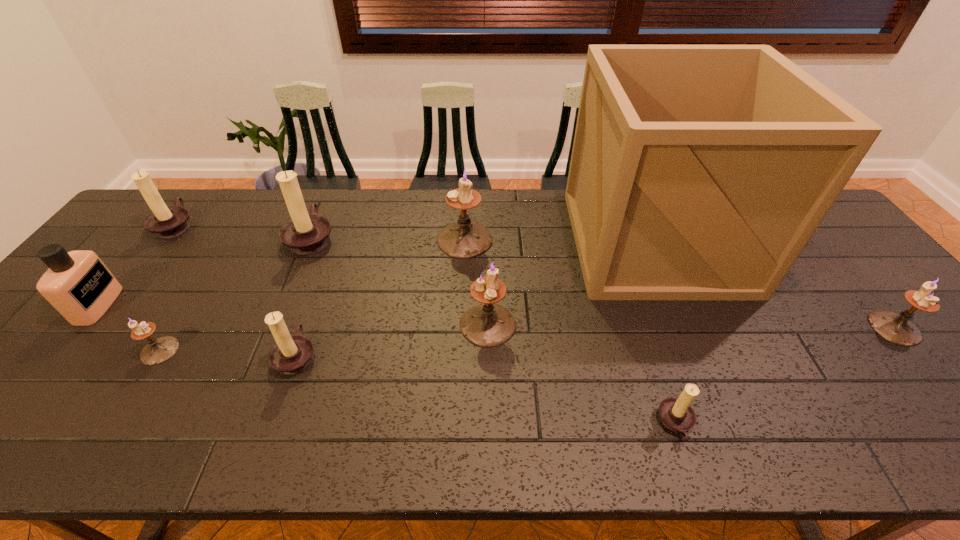
Find the location of a particular element. The width and height of the screenshot is (960, 540). candle holder that is the second closest to the nearest candle holder is located at coordinates (897, 328).

Locate which brown candle holder ranks third in proximity to the third farthest brown candle holder. Please provide its 2D coordinates. Your answer should be formatted as a tuple, i.e. [(x, y)], where the tuple contains the x and y coordinates of a point satisfying the conditions above.

[(676, 414)]

At what (x,y) coordinates should I click in order to perform the action: click on brown candle holder that can be found as the fourth closest to the rightmost object. Please return your answer as a coordinate pair (x, y). The image size is (960, 540). Looking at the image, I should click on (166, 222).

Identify which purple candle holder is the second closest to the third smallest purple candle holder. Please provide its 2D coordinates. Your answer should be formatted as a tuple, i.e. [(x, y)], where the tuple contains the x and y coordinates of a point satisfying the conditions above.

[(157, 351)]

I want to click on the second closest purple candle holder relative to the box, so click(x=897, y=328).

Where is `free space that satisfies the following two spatial constraints: 1. on the front label of the beige perfume; 2. on the left side of the rightmost object`? The image size is (960, 540). free space that satisfies the following two spatial constraints: 1. on the front label of the beige perfume; 2. on the left side of the rightmost object is located at coordinates (80, 328).

What are the coordinates of `vacant space that satisfies the following two spatial constraints: 1. on the front label of the beige perfume; 2. on the left side of the second biggest purple candle holder` in the screenshot? It's located at (83, 325).

Image resolution: width=960 pixels, height=540 pixels. I want to click on free region that satisfies the following two spatial constraints: 1. on the wick of the biggest brown candle holder; 2. on the back side of the third biggest purple candle holder, so (x=273, y=328).

What are the coordinates of `free space in the image that satisfies the following two spatial constraints: 1. on the wick of the biggest brown candle holder; 2. on the back side of the second biggest purple candle holder` in the screenshot? It's located at pyautogui.click(x=275, y=325).

Where is `vacant space that satisfies the following two spatial constraints: 1. on the front label of the eighth object from right to left; 2. on the left side of the beige perfume`? vacant space that satisfies the following two spatial constraints: 1. on the front label of the eighth object from right to left; 2. on the left side of the beige perfume is located at coordinates (61, 351).